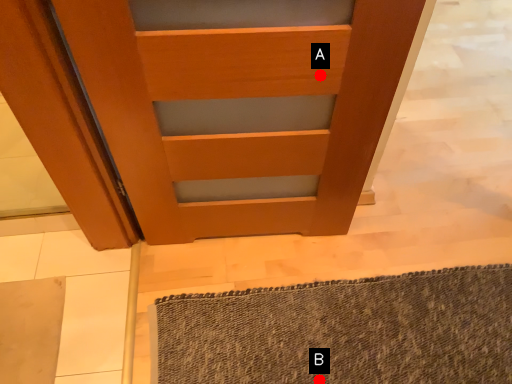
Question: Two points are circled on the image, labeled by A and B beside each circle. Which of the following is the closest to the observer?

Choices:
 (A) A is closer
 (B) B is closer

Answer: (A)